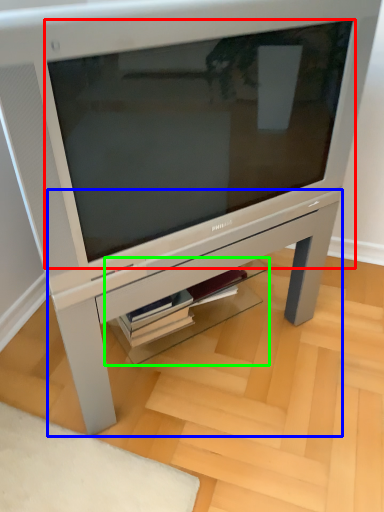
Question: Which is nearer to the computer monitor (highlighted by a red box)? table (highlighted by a blue box) or shelf (highlighted by a green box).

Choices:
 (A) table
 (B) shelf

Answer: (A)